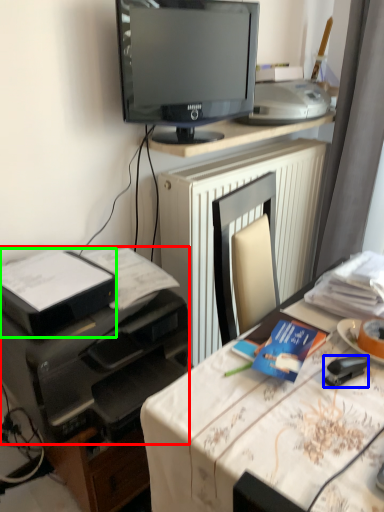
Question: Estimate the real-world distances between objects in this image. Which object is farther from printer (highlighted by a red box), stapler (highlighted by a blue box) or printer (highlighted by a green box)?

Choices:
 (A) stapler
 (B) printer

Answer: (A)